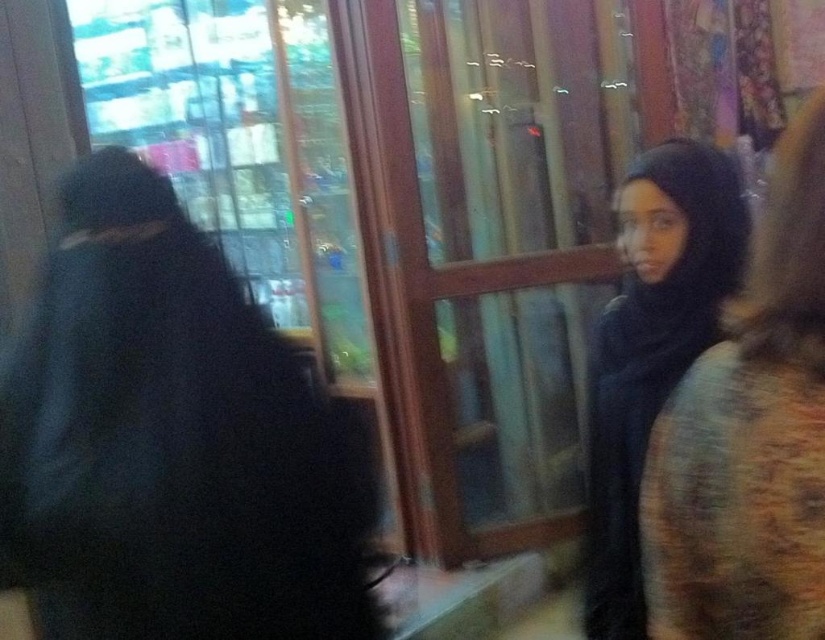
You are a store employee who needs to place a new tag on the taller item between the black matte coat at left and the black matte hijab at upper right. Which item should you tag?

The black matte coat at left is taller than the black matte hijab at upper right, so you should tag the black matte coat at left.

In the image, there are two people wearing dark clothing. One is facing the camera, and the other is turned away. The black matte coat at left is located at coordinates point [168,440]. Based on this information, can you determine which person is wearing the black matte coat at left?

The black matte coat at left is located at point [168,440], which corresponds to the person facing slightly towards the camera since they are positioned to the left side of the image.